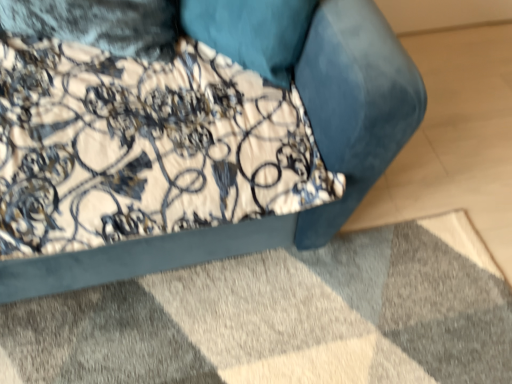
Question: Is point (439, 307) closer or farther from the camera than point (379, 122)?

Choices:
 (A) farther
 (B) closer

Answer: (A)

Question: Is velvet blue mat at lower center wider or thinner than velvet blue sofa at upper center?

Choices:
 (A) wide
 (B) thin

Answer: (A)

Question: In terms of height, does velvet blue mat at lower center look taller or shorter compared to velvet blue sofa at upper center?

Choices:
 (A) tall
 (B) short

Answer: (B)

Question: Is velvet blue sofa at upper center to the left or to the right of velvet blue mat at lower center in the image?

Choices:
 (A) right
 (B) left

Answer: (B)

Question: Considering the positions of point (380, 41) and point (336, 322), is point (380, 41) closer or farther from the camera than point (336, 322)?

Choices:
 (A) closer
 (B) farther

Answer: (A)

Question: Considering the positions of velvet blue sofa at upper center and velvet blue mat at lower center in the image, is velvet blue sofa at upper center bigger or smaller than velvet blue mat at lower center?

Choices:
 (A) small
 (B) big

Answer: (B)

Question: In the image, is velvet blue sofa at upper center positioned in front of or behind velvet blue mat at lower center?

Choices:
 (A) front
 (B) behind

Answer: (A)